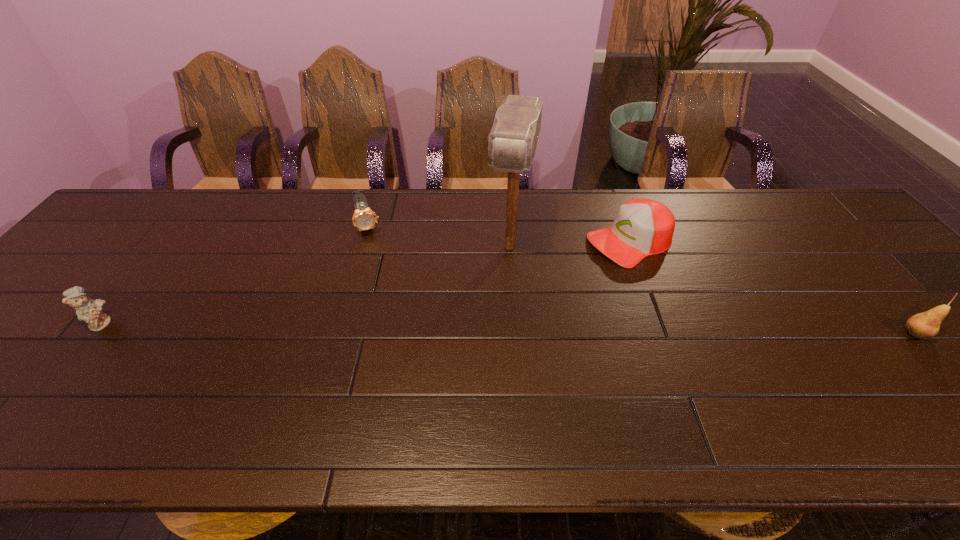
What are the coordinates of `vacant area located above the head of the mallet` in the screenshot? It's located at (483, 367).

Where is `vacant point located on the face of the watch`? The height and width of the screenshot is (540, 960). vacant point located on the face of the watch is located at coordinates (376, 261).

Image resolution: width=960 pixels, height=540 pixels. Identify the location of free space located on the face of the watch. (384, 286).

This screenshot has height=540, width=960. Identify the location of free space located on the face of the watch. pos(396,326).

Where is `vacant region located on the front-facing side of the fourth object from left to right`? The height and width of the screenshot is (540, 960). vacant region located on the front-facing side of the fourth object from left to right is located at coordinates (559, 275).

This screenshot has width=960, height=540. Find the location of `vacant space positioned 0.050m on the front-facing side of the fourth object from left to right`. vacant space positioned 0.050m on the front-facing side of the fourth object from left to right is located at coordinates (585, 262).

Locate an element on the screen. This screenshot has height=540, width=960. vacant point located on the front-facing side of the fourth object from left to right is located at coordinates (573, 268).

Identify the location of mallet located in the far edge section of the desktop. Image resolution: width=960 pixels, height=540 pixels. (513, 139).

Locate an element on the screen. The height and width of the screenshot is (540, 960). watch located at the far edge is located at coordinates (364, 218).

What are the coordinates of `baseball cap that is at the far edge` in the screenshot? It's located at (642, 227).